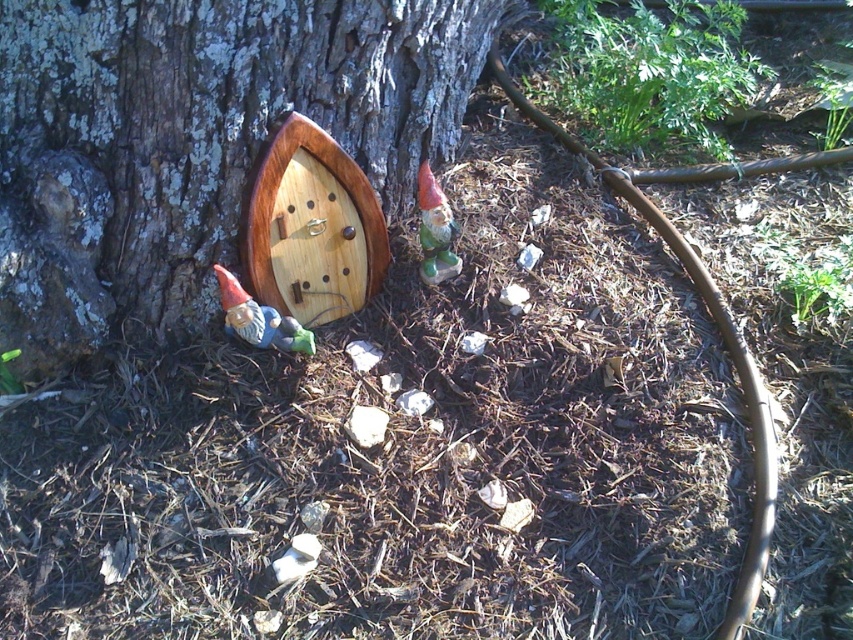
Describe the element at coordinates (194, 140) in the screenshot. I see `smooth bark tree at center` at that location.

At what (x,y) coordinates should I click in order to perform the action: click on smooth bark tree at center. Please return your answer as a coordinate pair (x, y). The width and height of the screenshot is (853, 640). Looking at the image, I should click on (194, 140).

Can you confirm if matte ceramic gnome at lower left is positioned above green matte gnome at center?

Incorrect, matte ceramic gnome at lower left is not positioned above green matte gnome at center.

Locate an element on the screen. matte ceramic gnome at lower left is located at coordinates (259, 317).

The width and height of the screenshot is (853, 640). Describe the element at coordinates (194, 140) in the screenshot. I see `smooth bark tree at center` at that location.

Between point (9, 212) and point (225, 276), which one is positioned in front?

Point (225, 276)

Is point (85, 104) more distant than point (234, 298)?

Yes, it is behind point (234, 298).

You are a GUI agent. You are given a task and a screenshot of the screen. Output one action in this format:
    pyautogui.click(x=<x>, y=<y>)
    Task: Click on the smooth bark tree at center
    The height and width of the screenshot is (640, 853).
    Given the screenshot: What is the action you would take?
    pyautogui.click(x=194, y=140)